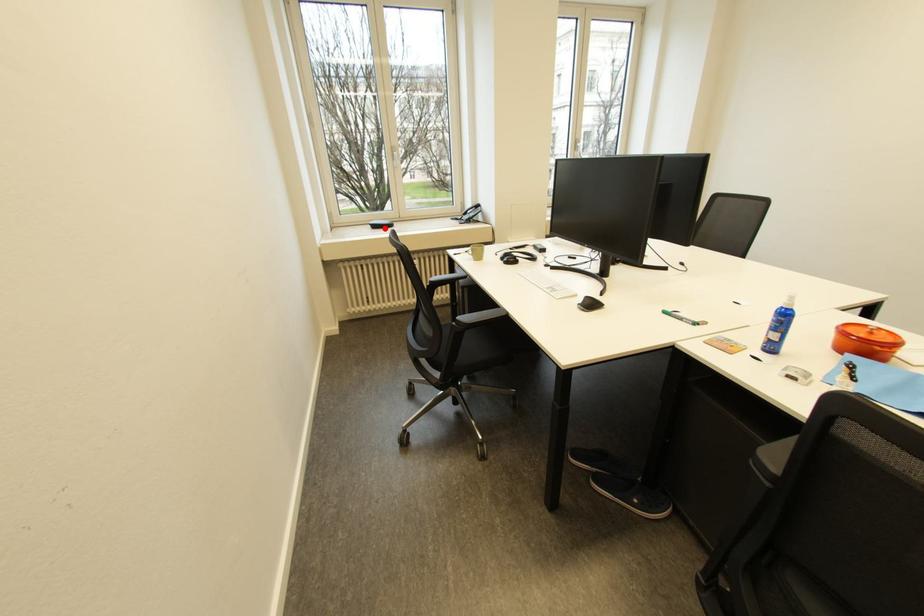
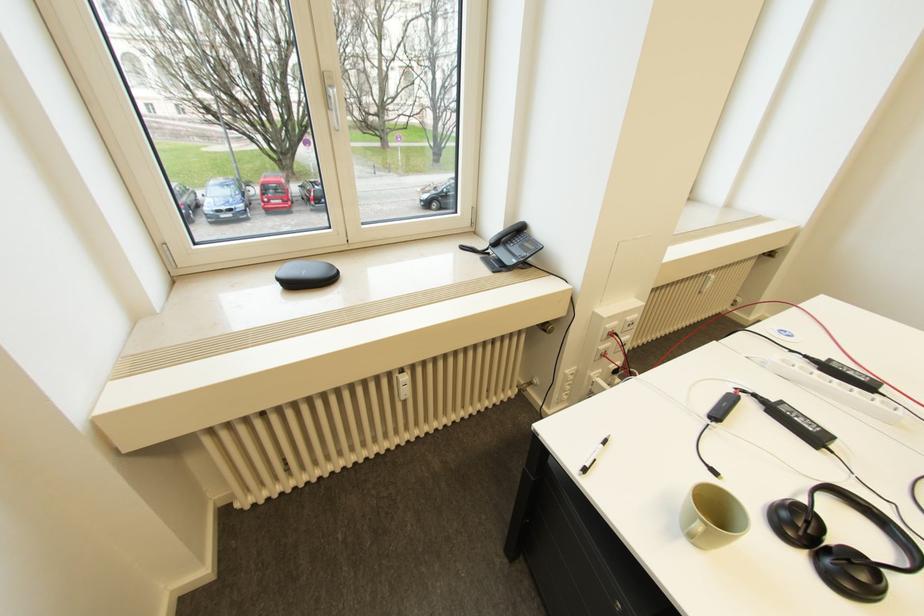
Locate, in the second image, the point that corresponds to the highlighted location in the first image.

(301, 285)